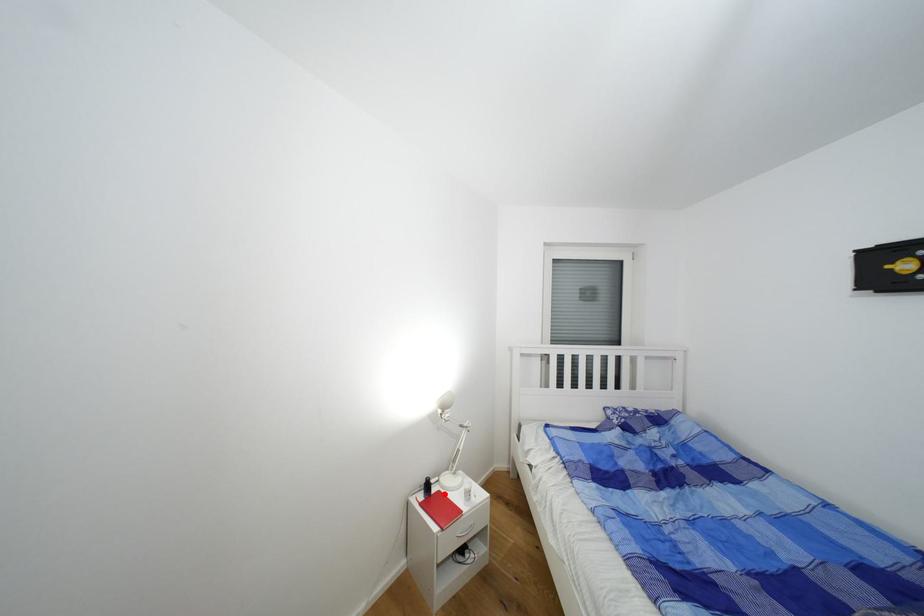
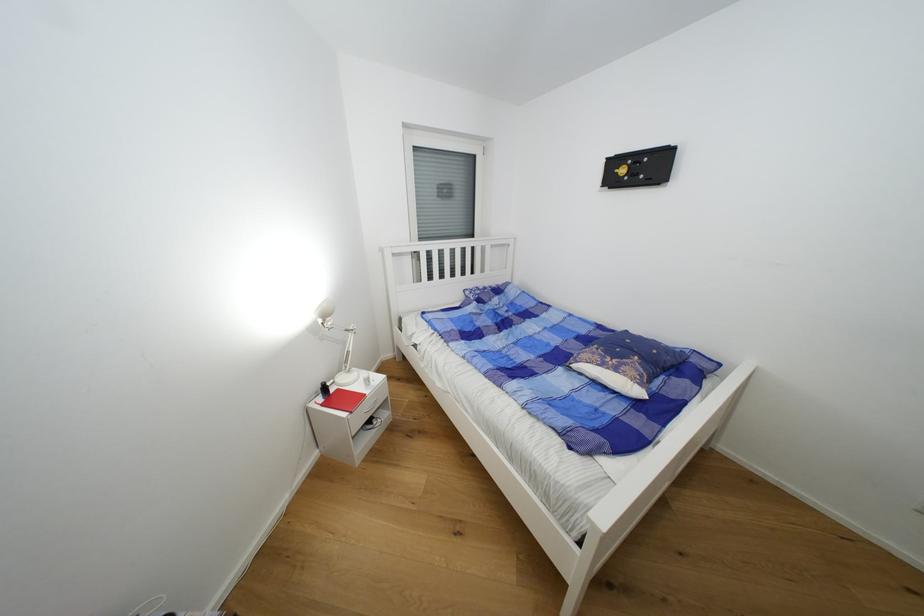
Question: I am providing you with two images of the same scene from different viewpoints. A red point is marked on the first image. Can you still see the location of the red point in image 2?

Choices:
 (A) Yes
 (B) No

Answer: (A)